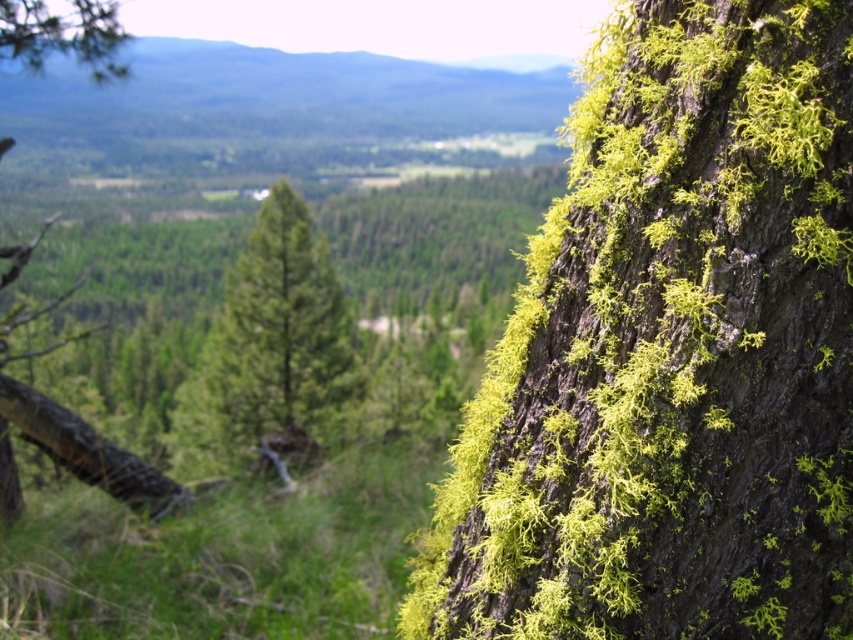
Question: Is green textured pine tree at center further to camera compared to green mossy tree trunk at left?

Choices:
 (A) no
 (B) yes

Answer: (B)

Question: Which point is farther to the camera?

Choices:
 (A) click(x=735, y=324)
 (B) click(x=90, y=1)

Answer: (B)

Question: Is green textured pine tree at center to the left of green mossy tree trunk at left from the viewer's perspective?

Choices:
 (A) yes
 (B) no

Answer: (B)

Question: Which of the following is the closest to the observer?

Choices:
 (A) green mossy tree trunk at left
 (B) green mossy bark at right

Answer: (B)

Question: Is green mossy bark at right closer to the viewer compared to green textured pine tree at center?

Choices:
 (A) no
 (B) yes

Answer: (B)

Question: Based on their relative distances, which object is nearer to the green textured pine tree at center?

Choices:
 (A) green mossy tree trunk at left
 (B) green mossy bark at right

Answer: (A)